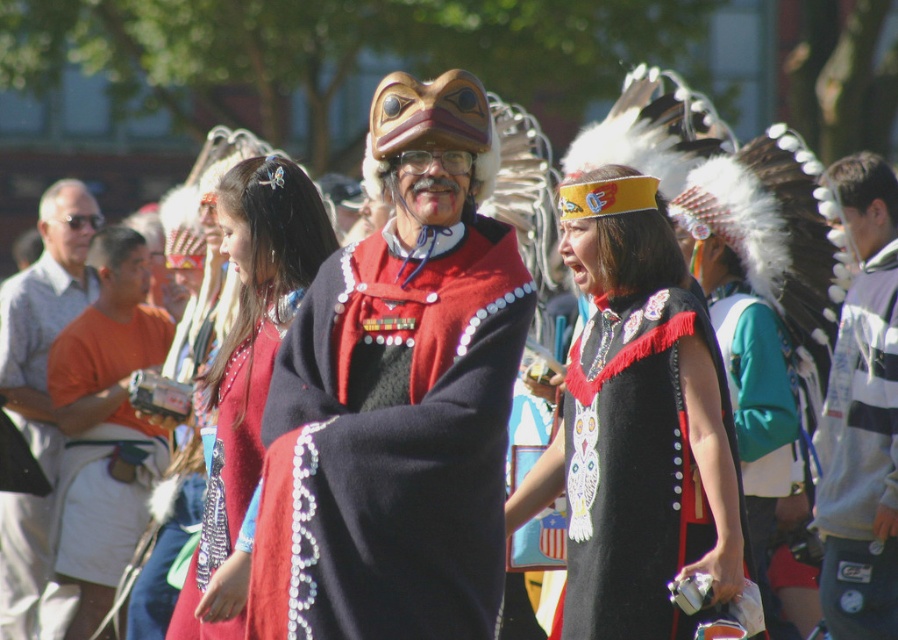
Question: Does black felt cape at center appear over gray striped hoodie at right?

Choices:
 (A) no
 (B) yes

Answer: (A)

Question: Among these objects, which one is farthest from the camera?

Choices:
 (A) velvet red cape at center
 (B) gray striped hoodie at right
 (C) black felt cape at center
 (D) gray striped shirt at left

Answer: (D)

Question: Based on their relative distances, which object is nearer to the gray striped hoodie at right?

Choices:
 (A) black felt cape at center
 (B) orange cotton shirt at left

Answer: (A)

Question: Which point is farther to the camera?

Choices:
 (A) matte red dress at center
 (B) velvet red cape at center
 (C) orange cotton shirt at left

Answer: (C)

Question: Does matte red dress at center appear under orange cotton shirt at left?

Choices:
 (A) yes
 (B) no

Answer: (B)

Question: In this image, where is velvet red cape at center located relative to gray striped shirt at left?

Choices:
 (A) above
 (B) below

Answer: (B)